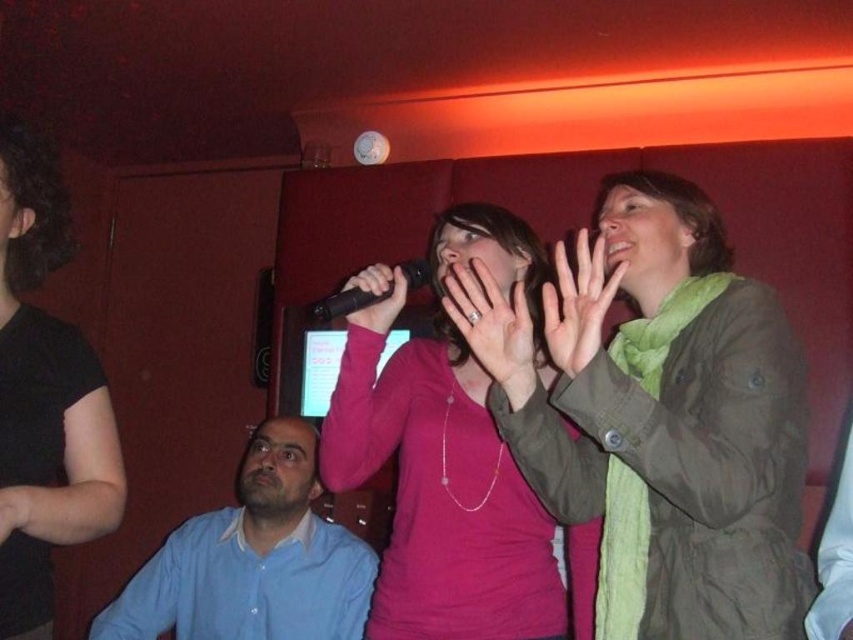
You are a photographer at the karaoke bar and want to capture a photo of the matte pink shirt at center and the green fabric hand at upper center. Which object should you focus on first if you want to ensure both are in focus?

The matte pink shirt at center is much taller than the green fabric hand at upper center, so focusing on the matte pink shirt at center first will help ensure both are in focus since it is closer to the camera.

You are a photographer positioned at the center of the room. You want to take a photo of the woman in the bright pink long sleeved shirt on the left and the green matte jacket at upper right. Which object is closer to the center of the room?

The woman in the bright pink long sleeved shirt on the left is closer to the center of the room than the green matte jacket at upper right.

In the scene shown: You are standing at the entrance of the karaoke bar and see two points in the image. The first point is at coordinate point [24,189] and the second point is at coordinate point [570,355]. Which point is closer to you?

Point [24,189] is behind point [570,355], so the closer point to you is point [570,355].